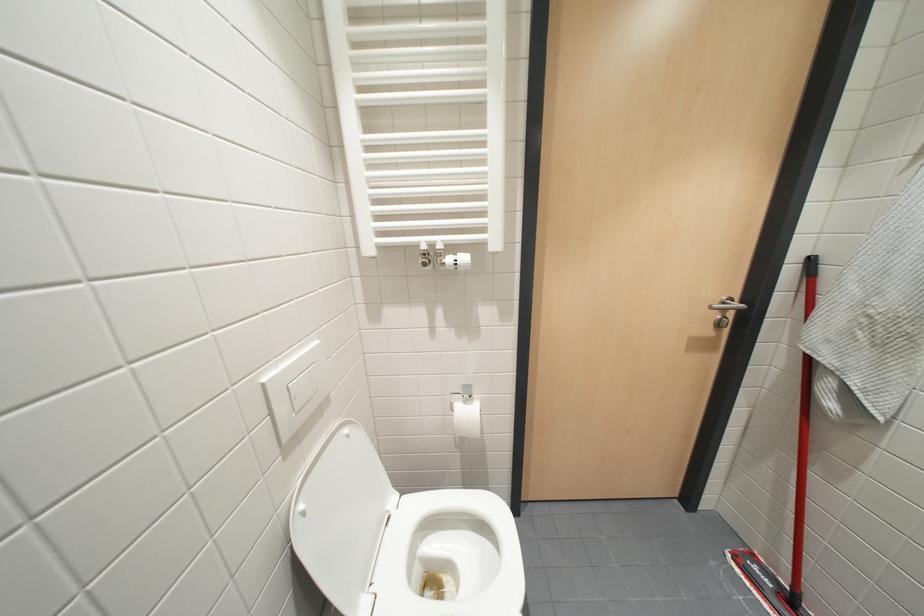
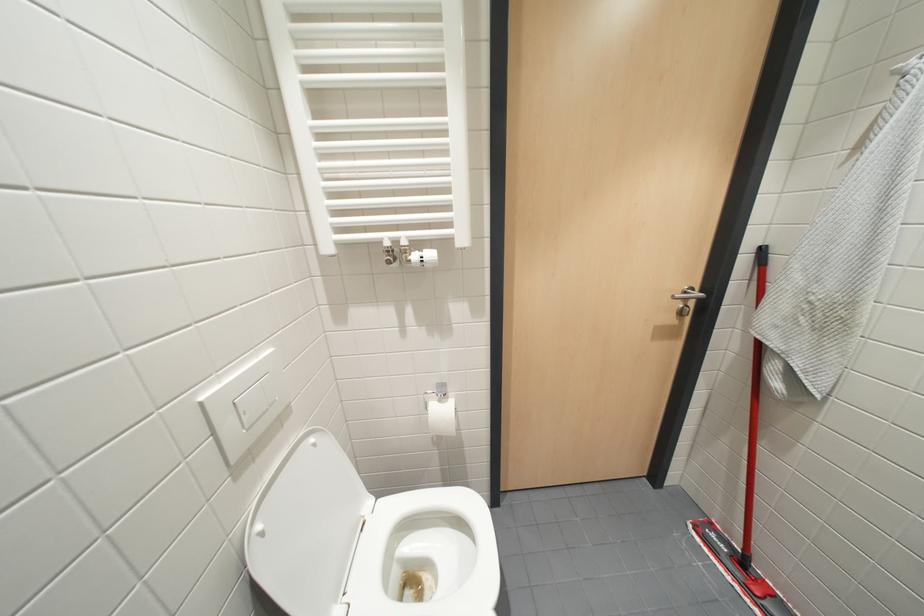
Question: The first image is from the beginning of the video and the second image is from the end. How did the camera likely rotate when shooting the video?

Choices:
 (A) Left
 (B) Right
 (C) Up
 (D) Down

Answer: (B)